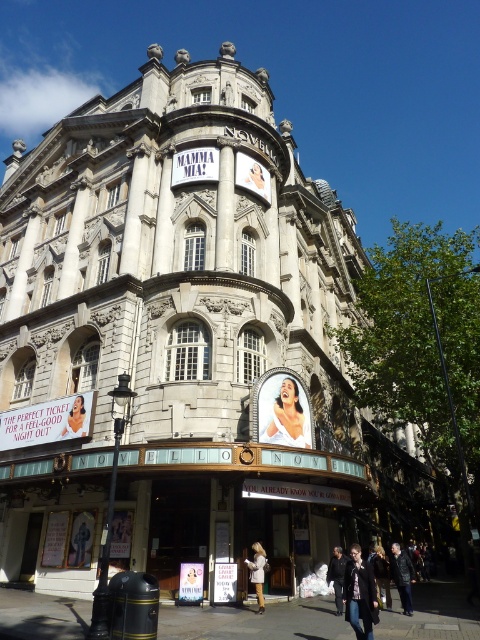
Question: Where is white cotton jacket at center located in relation to light brown leather jacket at center in the image?

Choices:
 (A) below
 (B) above

Answer: (A)

Question: Which point appears closest to the camera in this image?

Choices:
 (A) (387, 602)
 (B) (338, 614)

Answer: (B)

Question: Is white glossy dress at center wider than white cotton jacket at center?

Choices:
 (A) yes
 (B) no

Answer: (A)

Question: Can you confirm if leather jacket at lower right is positioned above matte black poster at center?

Choices:
 (A) yes
 (B) no

Answer: (B)

Question: Which point is closer to the camera taking this photo?

Choices:
 (A) (262, 588)
 (B) (371, 561)
 (C) (399, 596)
 (D) (81, 422)

Answer: (A)

Question: Considering the real-world distances, which object is closest to the dark blue jeans at lower center?

Choices:
 (A) dark gray jacket at center
 (B) white cotton jacket at center

Answer: (B)